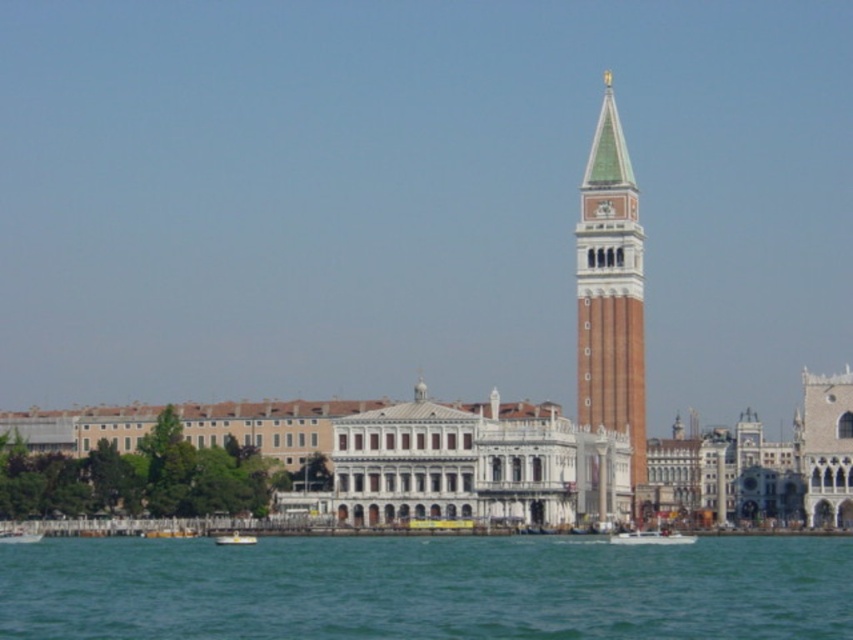
You are a tourist standing on the waterfront and want to take a photo that includes both the brick tower at center and the white plastic boat at lower center. Which object should you position closer to the camera to ensure both are in the frame?

To include both the brick tower at center and the white plastic boat at lower center in the photo, you should position the white plastic boat at lower center closer to the camera since the brick tower at center is larger and might dominate the frame otherwise.

You are an architect designing a new observation deck. You need to ensure that the deck can accommodate both a large water feature and a central tower structure. Given the scene you see, which object in the image has a greater width, the blue water at lower center or the brick tower at center?

The blue water at lower center has a greater width than the brick tower at center according to the description.